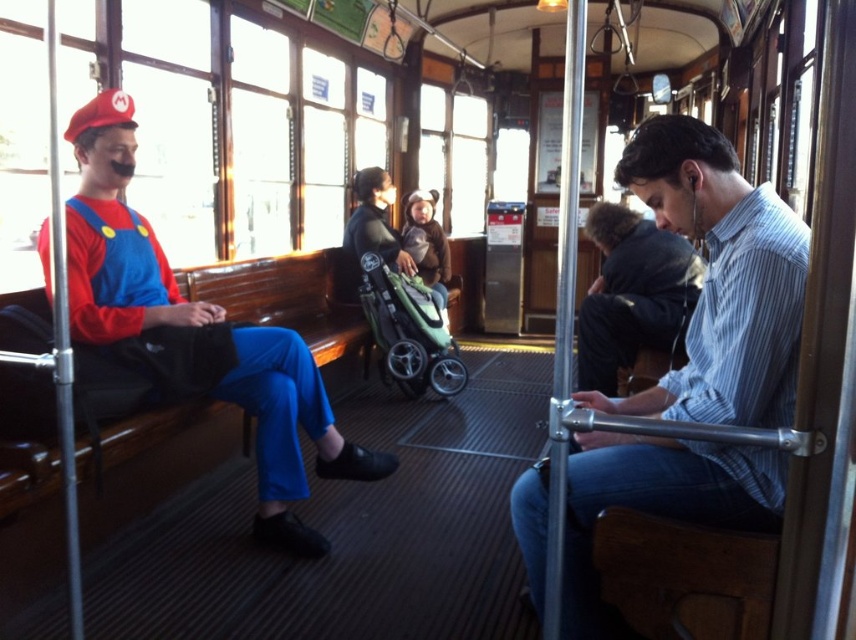
Who is more forward, [681,502] or [144,371]?

Point [681,502] is more forward.

What are the coordinates of `striped cotton shirt at right` in the screenshot? It's located at (720, 280).

Does matte blue jumpsuit at left lie in front of striped cotton shirt at center?

Yes, matte blue jumpsuit at left is in front of striped cotton shirt at center.

Which of these two, matte blue jumpsuit at left or striped cotton shirt at center, stands shorter?

Standing shorter between the two is striped cotton shirt at center.

Is point (294, 406) farther from camera compared to point (609, 385)?

That is False.

I want to click on matte blue jumpsuit at left, so click(194, 332).

Who is positioned more to the right, striped cotton shirt at right or green fabric stroller at center?

striped cotton shirt at right

Who is more forward, (718, 518) or (385, 346)?

Point (718, 518)

Which is in front, point (625, 449) or point (389, 337)?

Point (625, 449) is more forward.

Image resolution: width=856 pixels, height=640 pixels. Find the location of `striped cotton shirt at right`. striped cotton shirt at right is located at coordinates (x=720, y=280).